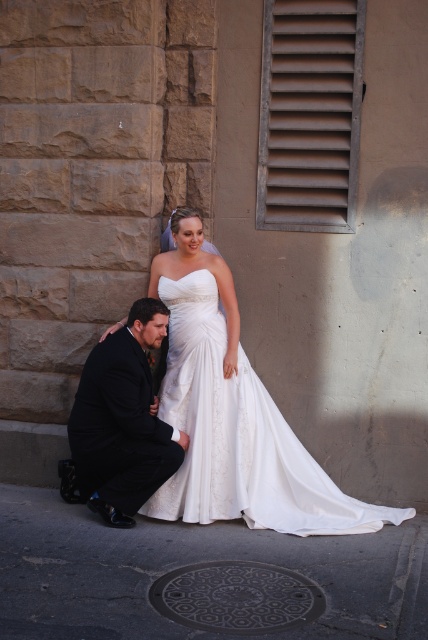
You are a photographer at a wedding. You need to capture a photo where the white satin dress at center is visible above the dark suit at lower left. Can you adjust the camera angle to achieve this?

The white satin dress at center is positioned under the dark suit at lower left, so adjusting the camera angle to look downward might allow the dress to be seen above the suit.

You are a photographer at a wedding. You need to capture a photo of the white satin dress at center and dark suit at lower left. Based on their positions, which one is on the right side?

The white satin dress at center is positioned on the right side of dark suit at lower left, so the white satin dress at center is on the right side.

You are a photographer positioned at the center of the scene. You need to place two markers at point (195, 429) and point (157, 436). Which point is closer to your current position?

Point (195, 429) is further to the viewer than point (157, 436), so the closer point to your position would be point (157, 436).